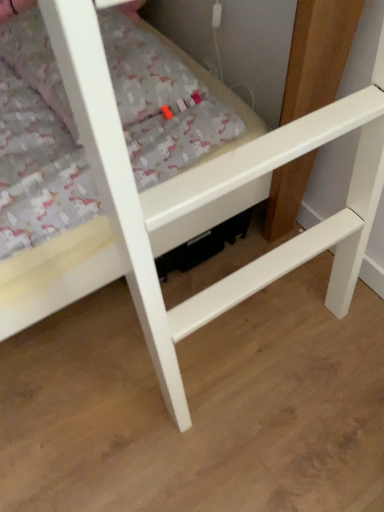
Question: Should I look upward or downward to see patterned fabric mattress at center?

Choices:
 (A) down
 (B) up

Answer: (B)